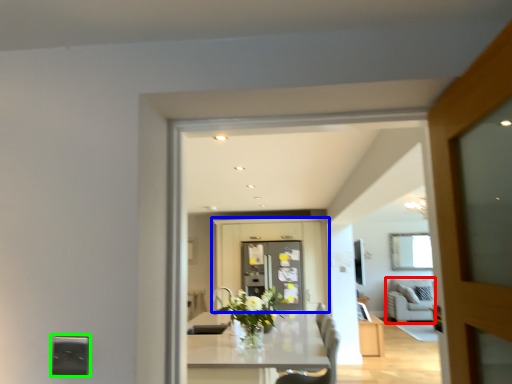
Question: Considering the real-world distances, which object is closest to couch (highlighted by a red box)? cabinetry (highlighted by a blue box) or electric outlet (highlighted by a green box).

Choices:
 (A) cabinetry
 (B) electric outlet

Answer: (A)